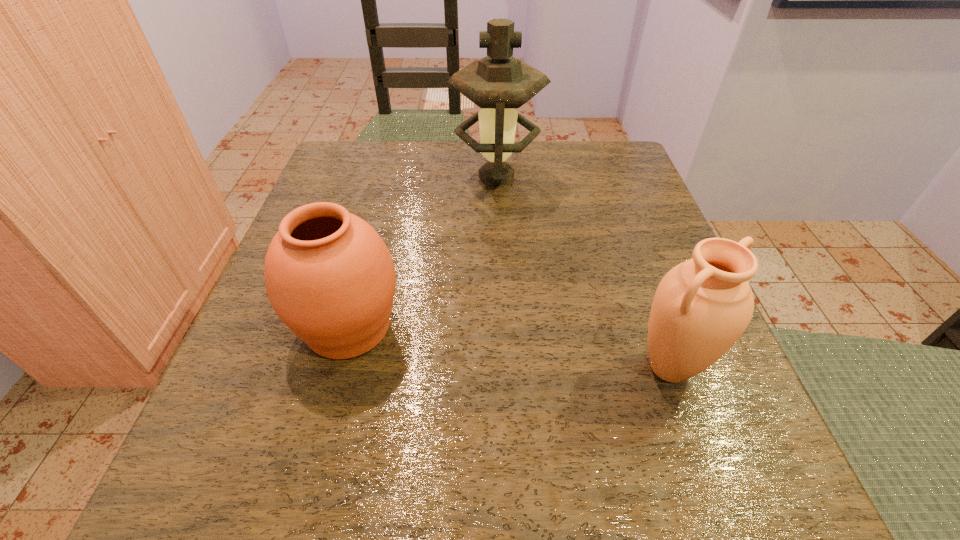
This screenshot has height=540, width=960. In the image, there is a desktop. What are the coordinates of `vacant space at the far edge` in the screenshot? It's located at (553, 168).

Locate an element on the screen. vacant space at the near edge of the desktop is located at coordinates (491, 515).

Identify the location of vacant area at the left edge. (270, 366).

The height and width of the screenshot is (540, 960). In order to click on free space at the right edge in this screenshot , I will do `click(599, 244)`.

This screenshot has width=960, height=540. What are the coordinates of `blank area at the near left corner` in the screenshot? It's located at (260, 517).

I want to click on free region at the near right corner of the desktop, so click(654, 516).

At what (x,y) coordinates should I click in order to perform the action: click on free area in between the rightmost object and the left urn. Please return your answer as a coordinate pair (x, y). This screenshot has width=960, height=540. Looking at the image, I should click on (509, 347).

Where is `vacant area between the tallest object and the rightmost object`? This screenshot has width=960, height=540. vacant area between the tallest object and the rightmost object is located at coordinates (583, 272).

At what (x,y) coordinates should I click in order to perform the action: click on free space between the right urn and the leftmost object. Please return your answer as a coordinate pair (x, y). Image resolution: width=960 pixels, height=540 pixels. Looking at the image, I should click on (509, 347).

In order to click on vacant area that lies between the second object from left to right and the left urn in this screenshot , I will do tap(422, 252).